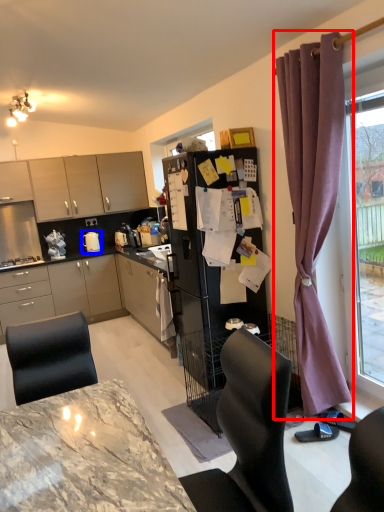
Question: Which point is further to the camera, curtain (highlighted by a red box) or appliance (highlighted by a blue box)?

Choices:
 (A) curtain
 (B) appliance

Answer: (B)